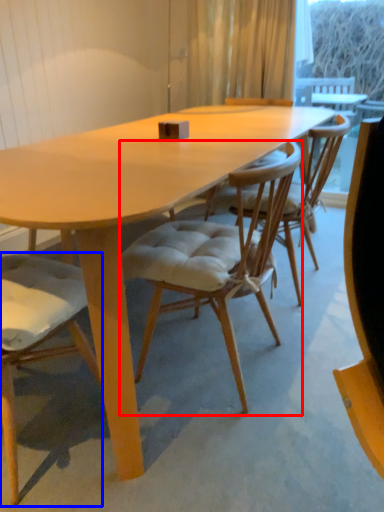
Question: Which of the following is the farthest to the observer, chair (highlighted by a red box) or chair (highlighted by a blue box)?

Choices:
 (A) chair
 (B) chair

Answer: (A)